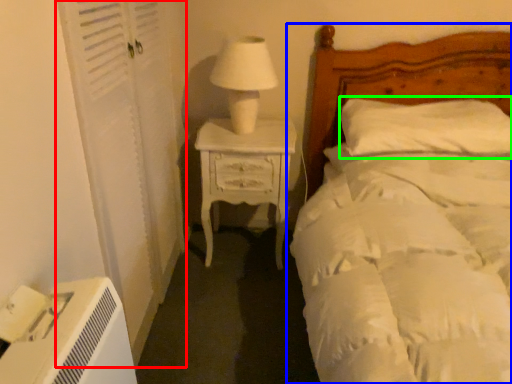
Question: Considering the real-world distances, which object is closest to screen door (highlighted by a red box)? bed (highlighted by a blue box) or pillow (highlighted by a green box).

Choices:
 (A) bed
 (B) pillow

Answer: (A)